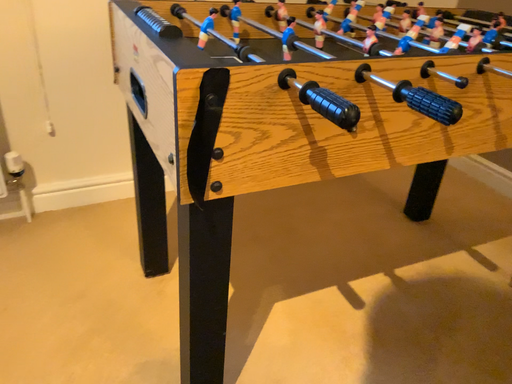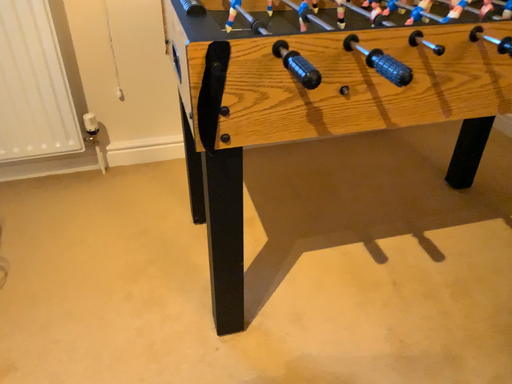
Question: Which way did the camera rotate in the video?

Choices:
 (A) rotated right
 (B) rotated left

Answer: (B)